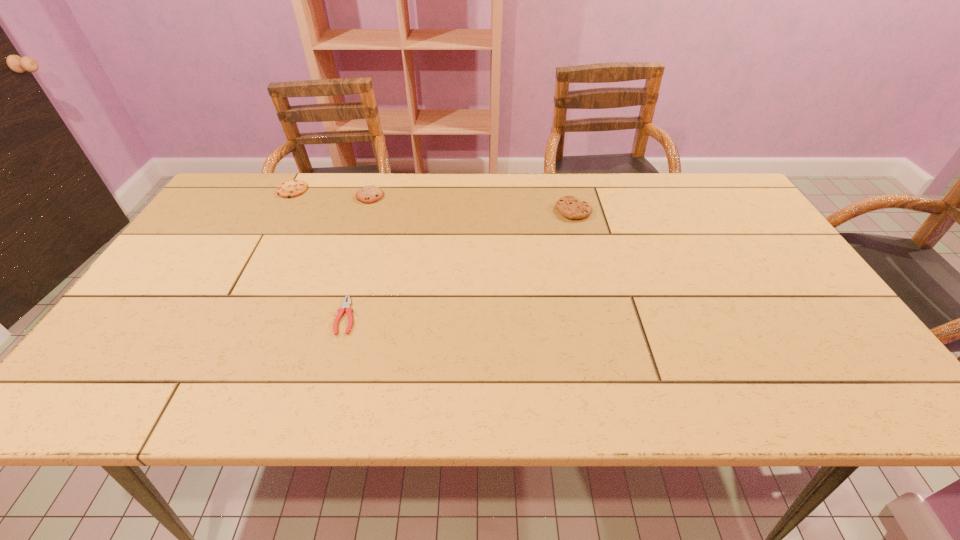
Locate which cookie ranks in proximity to the pliers. Please provide its 2D coordinates. Your answer should be formatted as a tuple, i.e. [(x, y)], where the tuple contains the x and y coordinates of a point satisfying the conditions above.

[(369, 194)]

Locate which cookie is the third closest to the pliers. Please provide its 2D coordinates. Your answer should be formatted as a tuple, i.e. [(x, y)], where the tuple contains the x and y coordinates of a point satisfying the conditions above.

[(570, 207)]

Where is `vacant space that satisfies the following two spatial constraints: 1. on the front side of the leftmost object; 2. on the left side of the tallest cookie`? vacant space that satisfies the following two spatial constraints: 1. on the front side of the leftmost object; 2. on the left side of the tallest cookie is located at coordinates (280, 211).